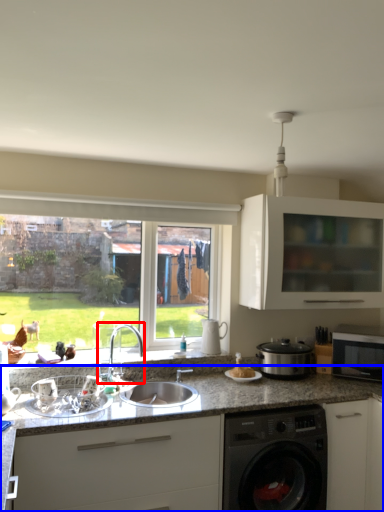
Question: Which point is further to the camera, tap (highlighted by a red box) or countertop (highlighted by a blue box)?

Choices:
 (A) tap
 (B) countertop

Answer: (A)